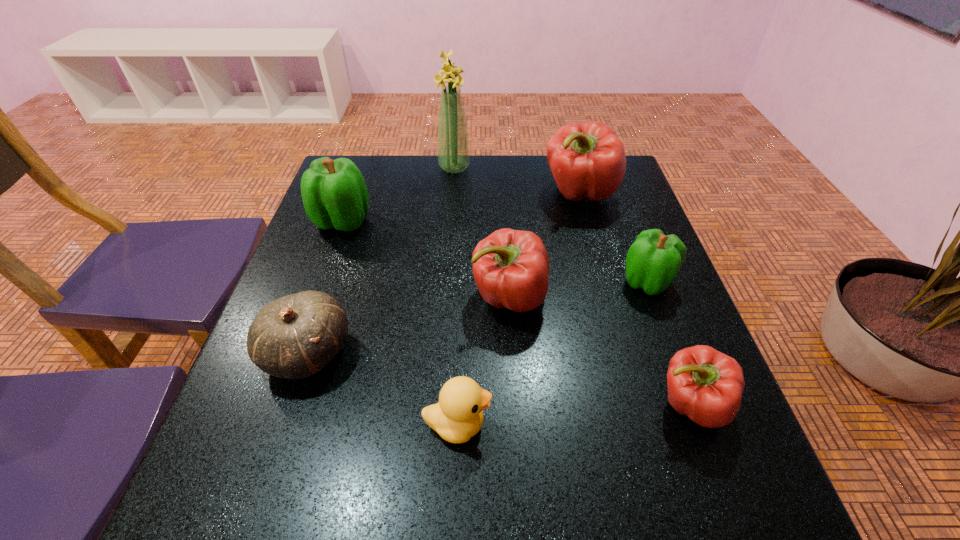
Image resolution: width=960 pixels, height=540 pixels. Identify the location of empty space between the nearer green bell pepper and the yellow duck. (552, 353).

The height and width of the screenshot is (540, 960). What are the coordinates of `vacant space that's between the bigger green bell pepper and the biggest pink bell pepper` in the screenshot? It's located at (461, 207).

This screenshot has width=960, height=540. Find the location of `empty space that is in between the yellow duck and the gourd`. empty space that is in between the yellow duck and the gourd is located at coordinates pos(382,388).

At what (x,y) coordinates should I click in order to perform the action: click on blank region between the leftmost pink bell pepper and the nearest pink bell pepper. Please return your answer as a coordinate pair (x, y). Image resolution: width=960 pixels, height=540 pixels. Looking at the image, I should click on (600, 351).

You are a GUI agent. You are given a task and a screenshot of the screen. Output one action in this format:
    pyautogui.click(x=<x>, y=<y>)
    Task: Click on the vacant area that lies between the biggest pink bell pepper and the tallest object
    The image size is (960, 540).
    Given the screenshot: What is the action you would take?
    pyautogui.click(x=516, y=180)

The width and height of the screenshot is (960, 540). What are the coordinates of `unoccupied area between the leftmost bell pepper and the biggest pink bell pepper` in the screenshot? It's located at (461, 207).

Identify the location of vacant area that lies between the gourd and the duck. This screenshot has height=540, width=960. (382, 388).

The height and width of the screenshot is (540, 960). Identify the location of vacant space that's between the farthest pink bell pepper and the gourd. (443, 273).

I want to click on unoccupied position between the tallest object and the smallest pink bell pepper, so click(x=572, y=286).

You are a GUI agent. You are given a task and a screenshot of the screen. Output one action in this format:
    pyautogui.click(x=<x>, y=<y>)
    Task: Click on the vacant area between the farthest pink bell pepper and the right green bell pepper
    The image size is (960, 540).
    Given the screenshot: What is the action you would take?
    pyautogui.click(x=612, y=238)